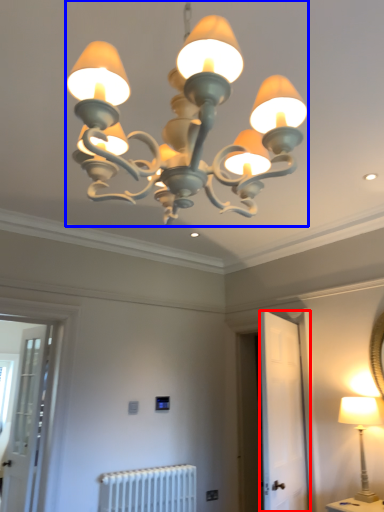
Question: Among these objects, which one is farthest to the camera, screen door (highlighted by a red box) or lamp (highlighted by a blue box)?

Choices:
 (A) screen door
 (B) lamp

Answer: (A)